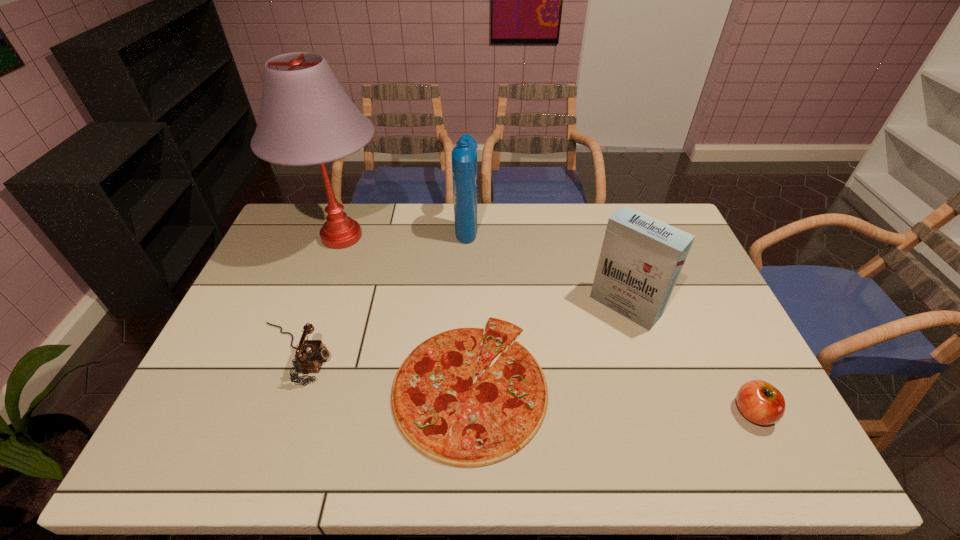
Identify which object is the closest to the table lamp. Please provide its 2D coordinates. Your answer should be formatted as a tuple, i.e. [(x, y)], where the tuple contains the x and y coordinates of a point satisfying the conditions above.

[(310, 354)]

Image resolution: width=960 pixels, height=540 pixels. In order to click on free space that satisfies the following two spatial constraints: 1. on the front side of the shortest object; 2. on the left side of the second tallest object in this screenshot , I will do `click(462, 383)`.

The image size is (960, 540). Find the location of `vacant space that satisfies the following two spatial constraints: 1. on the front-facing side of the tallest object; 2. on the back side of the fifth object from left to right`. vacant space that satisfies the following two spatial constraints: 1. on the front-facing side of the tallest object; 2. on the back side of the fifth object from left to right is located at coordinates (317, 306).

Locate an element on the screen. This screenshot has height=540, width=960. vacant area that satisfies the following two spatial constraints: 1. on the front-facing side of the tallest object; 2. on the right side of the apple is located at coordinates (278, 412).

The height and width of the screenshot is (540, 960). What are the coordinates of `vacant space that satisfies the following two spatial constraints: 1. on the back side of the rightmost object; 2. on the front-facing side of the table lamp` in the screenshot? It's located at (667, 237).

In order to click on free space in the image that satisfies the following two spatial constraints: 1. on the back side of the third tallest object; 2. on the front-facing side of the table lamp in this screenshot , I will do `click(603, 237)`.

Where is `vacant space that satisfies the following two spatial constraints: 1. on the dial of the pizza; 2. on the right side of the telephone`? This screenshot has height=540, width=960. vacant space that satisfies the following two spatial constraints: 1. on the dial of the pizza; 2. on the right side of the telephone is located at coordinates 282,383.

The height and width of the screenshot is (540, 960). In order to click on blank space that satisfies the following two spatial constraints: 1. on the dial of the telephone; 2. on the back side of the pizza in this screenshot , I will do `click(282, 383)`.